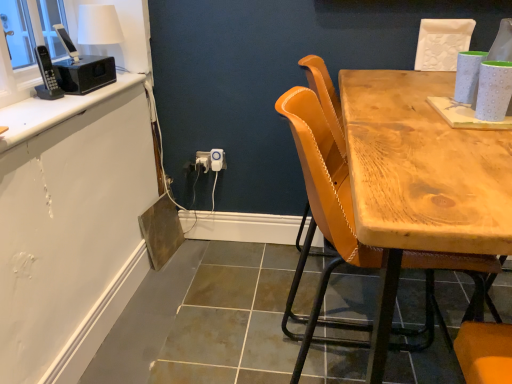
Question: From their relative heights in the image, would you say white plastic electric outlet at center is taller or shorter than leather-like yellow chair at center?

Choices:
 (A) short
 (B) tall

Answer: (A)

Question: From a real-world perspective, is white plastic electric outlet at center physically located above or below leather-like yellow chair at center?

Choices:
 (A) below
 (B) above

Answer: (A)

Question: Estimate the real-world distances between objects in this image. Which object is farther from the white plastic power outlet at lower center, placed as the 2th power outlet when sorted from right to left?

Choices:
 (A) white plastic power outlet at center, which is the first power outlet in right-to-left order
 (B) leather-like yellow chair at center
 (C) white plastic electric outlet at center
 (D) white glossy countertop at upper left

Answer: (B)

Question: Which is nearer to the white plastic power outlet at lower center, placed as the 2th power outlet when sorted from right to left?

Choices:
 (A) white plastic electric outlet at center
 (B) white glossy countertop at upper left
 (C) leather-like yellow chair at center
 (D) white plastic power outlet at center, positioned as the 2th power outlet in left-to-right order

Answer: (A)